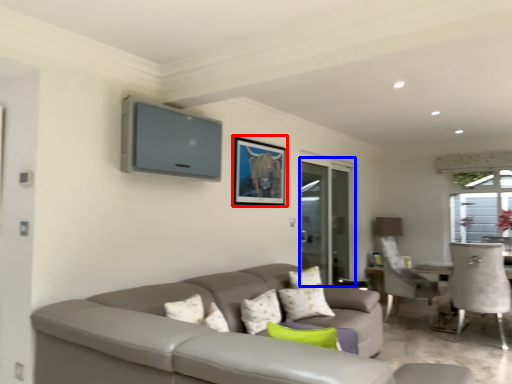
Question: Among these objects, which one is nearest to the camera, picture frame (highlighted by a red box) or screen door (highlighted by a blue box)?

Choices:
 (A) picture frame
 (B) screen door

Answer: (A)